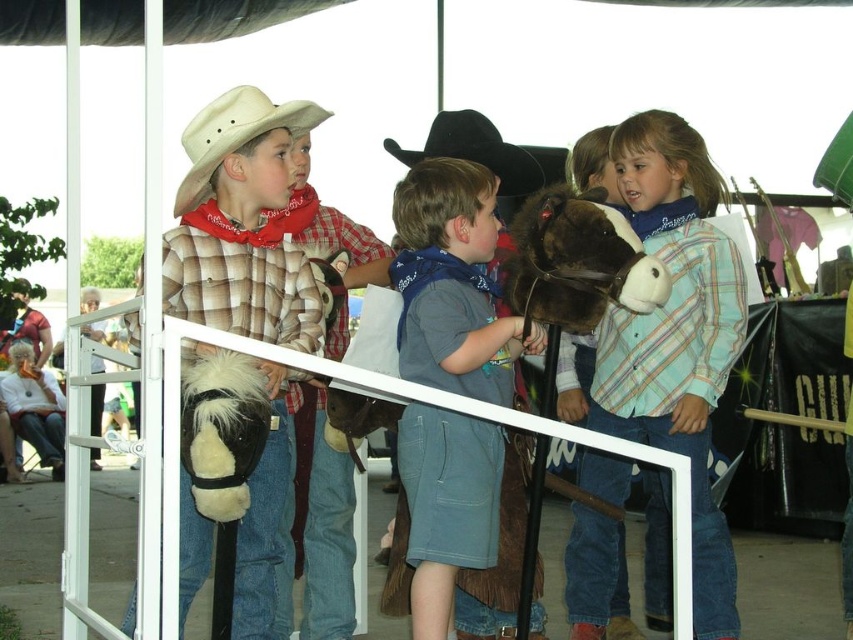
Based on the photo, you are a costume designer preparing for a play and need to ensure that the plaid shirt at left and the black felt cowboy hat at center fit the actors. Based on the description, which item is bigger in size?

The plaid shirt at left is larger in size compared to the black felt cowboy hat at center.

You are a photographer at the fair and want to capture a photo of the plaid shirt at left and the black felt cowboy hat at center. Which object is positioned lower in the image?

The plaid shirt at left is located below black felt cowboy hat at center, so the plaid shirt at left is positioned lower in the image.

You are a photographer at the fair trying to capture a child wearing both the blue denim shorts at center and the beige felt cowboy hat at left. Based on their positions, can you tell if the hat is above or below the shorts?

The blue denim shorts at center is below the beige felt cowboy hat at left, so the hat is above the shorts.